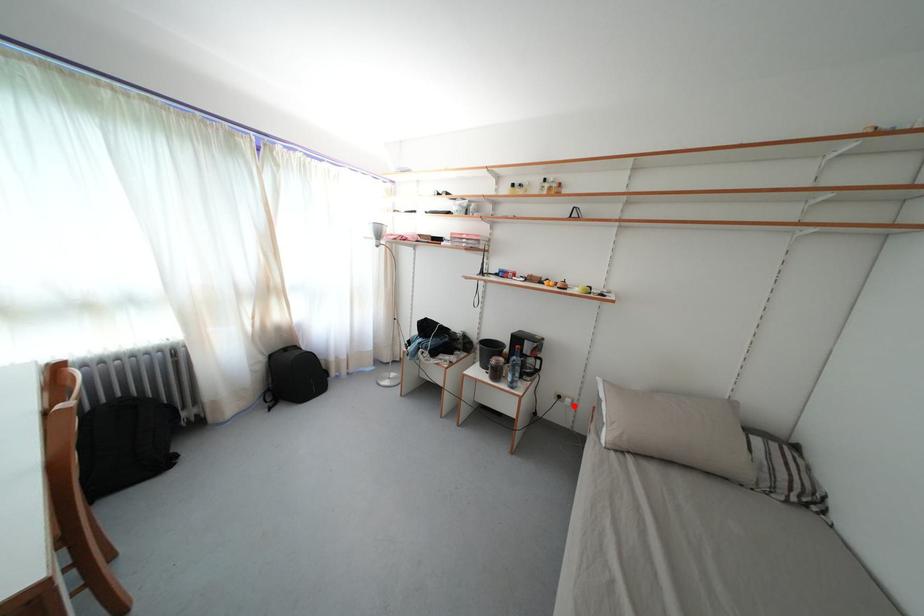
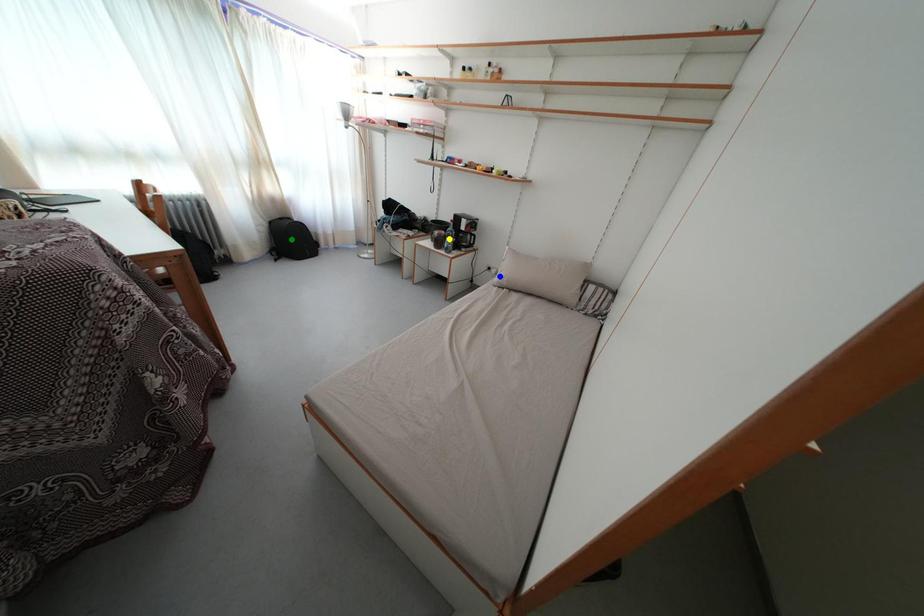
Question: I am providing you with two images of the same scene from different viewpoints. A red point is marked on the first image. You are given multiple points on the second image. Which mark in image 2 goes with the point in image 1?

Choices:
 (A) green point
 (B) yellow point
 (C) blue point

Answer: (C)